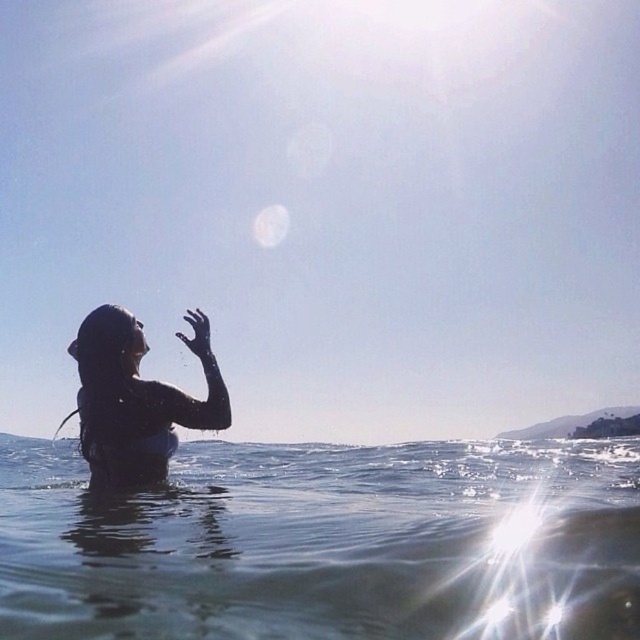
Between point (61, 609) and point (134, 324), which one is positioned in front?

Positioned in front is point (61, 609).

Can you confirm if clear liquid water at center is positioned to the left of wet hair at left?

In fact, clear liquid water at center is to the right of wet hair at left.

Does point (163, 580) lie in front of point (124, 465)?

Yes, point (163, 580) is closer to viewer.

The image size is (640, 640). I want to click on clear liquid water at center, so click(326, 541).